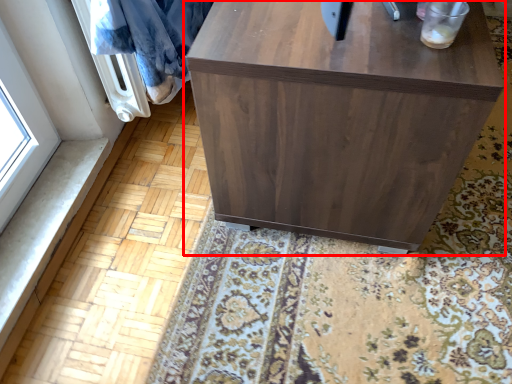
Question: From the image's perspective, considering the relative positions of furniture (annotated by the red box) and blanket in the image provided, where is furniture (annotated by the red box) located with respect to the staircase?

Choices:
 (A) above
 (B) below

Answer: (A)